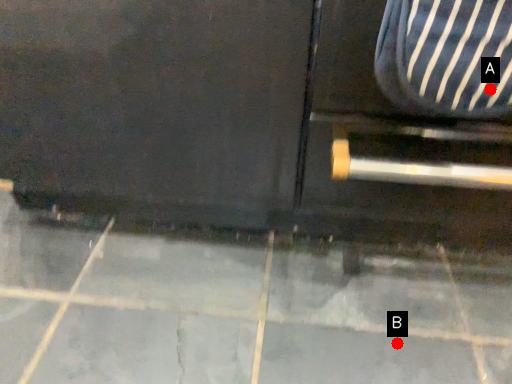
Question: Two points are circled on the image, labeled by A and B beside each circle. Which point is further to the camera?

Choices:
 (A) A is further
 (B) B is further

Answer: (B)